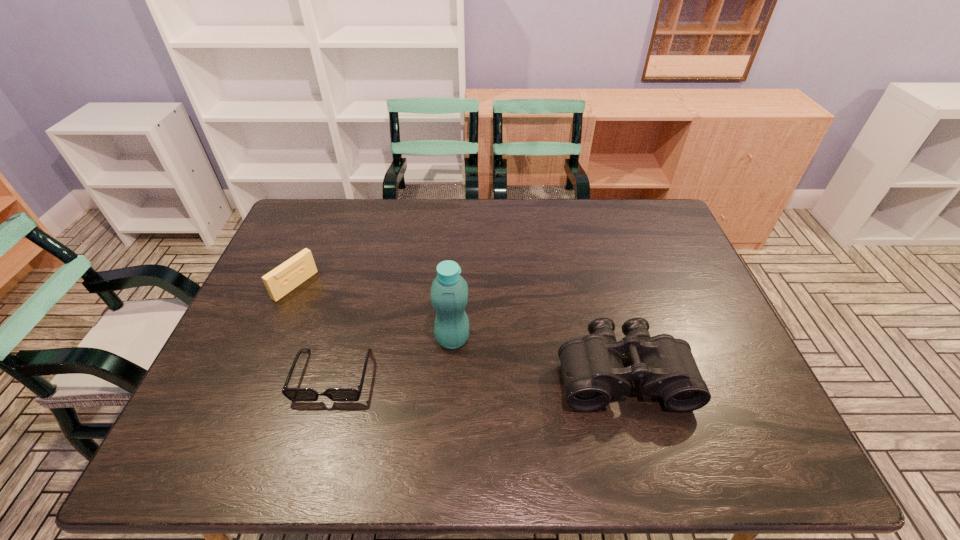
Locate an element on the screen. Image resolution: width=960 pixels, height=540 pixels. vacant space at the near edge is located at coordinates (399, 397).

Find the location of a particular element. The width and height of the screenshot is (960, 540). free space at the left edge is located at coordinates (313, 245).

Where is `free space at the right edge`? free space at the right edge is located at coordinates (699, 289).

In the image, there is a desktop. Where is `vacant space at the far right corner`? The image size is (960, 540). vacant space at the far right corner is located at coordinates (655, 230).

This screenshot has height=540, width=960. Find the location of `unoccupied area between the tallest object and the binoculars`. unoccupied area between the tallest object and the binoculars is located at coordinates (538, 356).

Where is `unoccupied position between the second shortest object and the tallest object`? This screenshot has width=960, height=540. unoccupied position between the second shortest object and the tallest object is located at coordinates (374, 312).

Locate an element on the screen. This screenshot has width=960, height=540. unoccupied area between the second tallest object and the tallest object is located at coordinates (538, 356).

Where is `empty space between the farthest object and the third object from right to left`? This screenshot has height=540, width=960. empty space between the farthest object and the third object from right to left is located at coordinates (314, 330).

Where is `vacant area between the third shortest object and the sunglasses`? The width and height of the screenshot is (960, 540). vacant area between the third shortest object and the sunglasses is located at coordinates (478, 375).

The image size is (960, 540). I want to click on free space between the third object from right to left and the second tallest object, so click(x=478, y=375).